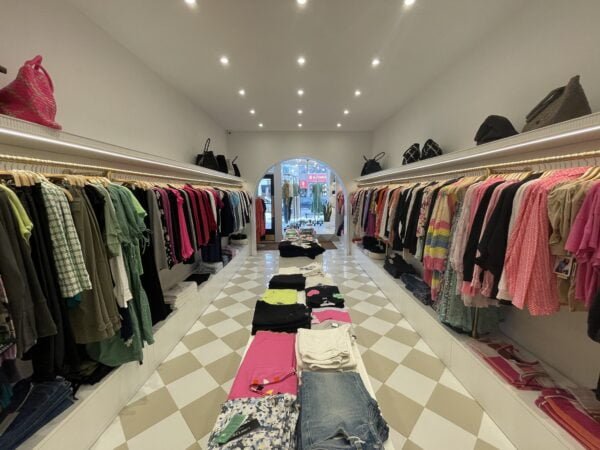
Find the location of `upper shelves`. upper shelves is located at coordinates (83, 131), (445, 152).